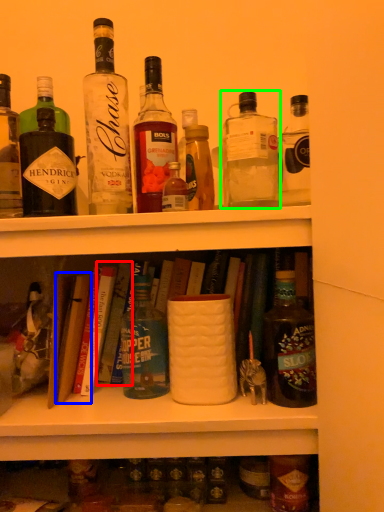
Question: Based on their relative distances, which object is farther from book (highlighted by a red box)? Choose from book (highlighted by a blue box) and bottle (highlighted by a green box).

Choices:
 (A) book
 (B) bottle

Answer: (B)